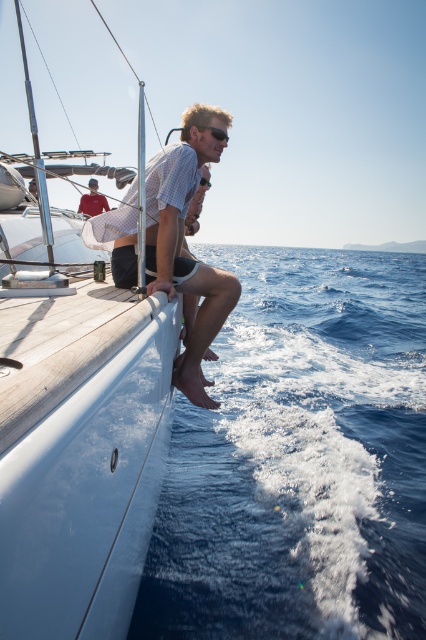
Question: Which point is farther to the camera?

Choices:
 (A) white glossy boat at left
 (B) matte red shirt at upper left
 (C) light brown wood man at center

Answer: (B)

Question: Does white glossy boat at left appear on the left side of light brown wood man at center?

Choices:
 (A) no
 (B) yes

Answer: (B)

Question: Can you confirm if white glossy boat at left is bigger than matte red shirt at upper left?

Choices:
 (A) no
 (B) yes

Answer: (B)

Question: Which point is closer to the camera?

Choices:
 (A) green matte sunglasses at center
 (B) matte red shirt at upper left
 (C) light brown wood man at center
 (D) blue water at lower right

Answer: (D)

Question: Among these objects, which one is farthest from the camera?

Choices:
 (A) light brown wood man at center
 (B) green matte sunglasses at center
 (C) white glossy boat at left
 (D) blue water at lower right

Answer: (B)

Question: Does light brown wood man at center appear under green matte sunglasses at center?

Choices:
 (A) yes
 (B) no

Answer: (A)